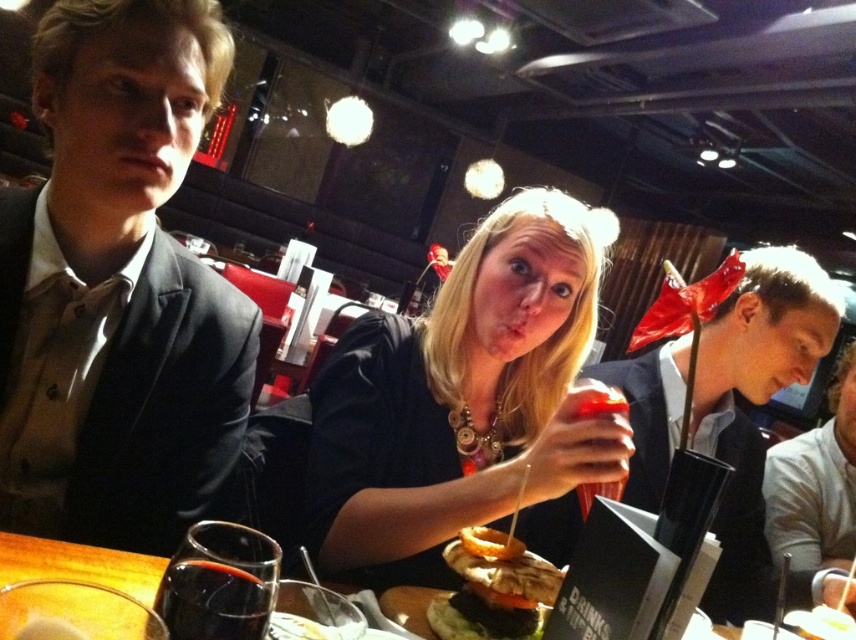
Consider the image. Is white matte shirt at lower right in front of dark glass beverage at lower left?

That is False.

Is white matte shirt at lower right above dark glass beverage at lower left?

No.

Describe the element at coordinates (815, 483) in the screenshot. I see `white matte shirt at lower right` at that location.

Identify the location of white matte shirt at lower right. The image size is (856, 640). (815, 483).

You are a GUI agent. You are given a task and a screenshot of the screen. Output one action in this format:
    pyautogui.click(x=<x>, y=<y>)
    Task: Click on the matte black suit at left
    The image size is (856, 640).
    Given the screenshot: What is the action you would take?
    pyautogui.click(x=122, y=278)

Identify the location of matte black suit at left. (122, 278).

What do you see at coordinates (497, 584) in the screenshot? I see `slightly toasted bun at center` at bounding box center [497, 584].

Locate an element on the screen. This screenshot has height=640, width=856. slightly toasted bun at center is located at coordinates (497, 584).

Which is in front, point (480, 552) or point (189, 560)?

Point (189, 560)

At what (x,y) coordinates should I click in order to perform the action: click on slightly toasted bun at center. Please return your answer as a coordinate pair (x, y). This screenshot has width=856, height=640. Looking at the image, I should click on (497, 584).